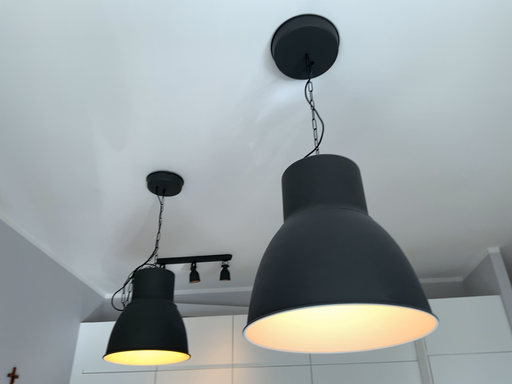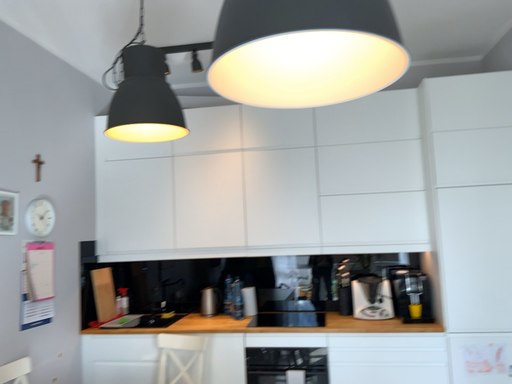
Question: Which way did the camera rotate in the video?

Choices:
 (A) rotated downward
 (B) rotated upward

Answer: (A)